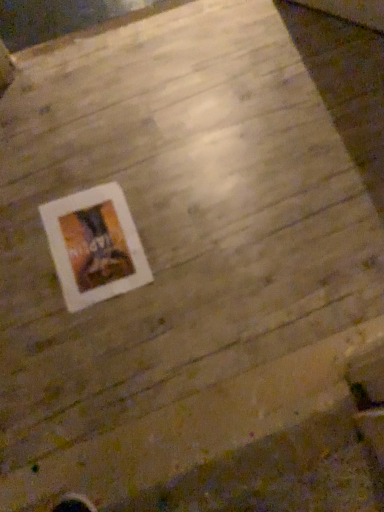
This screenshot has width=384, height=512. In order to click on vacant area to the right of white matte picture frame at center in this screenshot , I will do `click(184, 227)`.